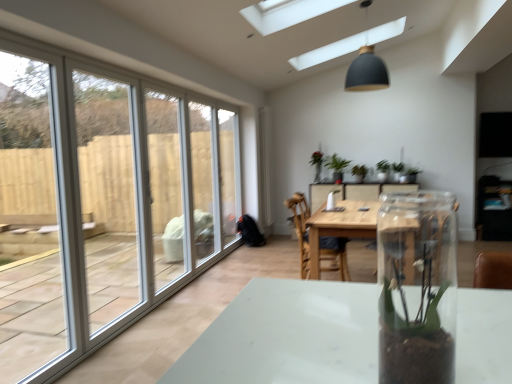
Where is `white plastic screen door at left, placed as the 2th screen door when sorted from back to front`? Image resolution: width=512 pixels, height=384 pixels. white plastic screen door at left, placed as the 2th screen door when sorted from back to front is located at coordinates (106, 196).

Describe the element at coordinates (106, 196) in the screenshot. I see `white plastic screen door at left, placed as the 1th screen door when sorted from front to back` at that location.

The height and width of the screenshot is (384, 512). What do you see at coordinates (301, 229) in the screenshot? I see `wooden chair at center` at bounding box center [301, 229].

The width and height of the screenshot is (512, 384). What do you see at coordinates (417, 287) in the screenshot? I see `clear glass vase at center` at bounding box center [417, 287].

Find the location of a particular element. This screenshot has width=512, height=384. green leafy plant at upper center, the 1th houseplant from the right is located at coordinates (359, 173).

I want to click on white plastic screen door at left, placed as the 2th screen door when sorted from back to front, so click(106, 196).

Can you confirm if green matte plant at center, which appears as the first houseplant when viewed from the left, is positioned to the right of wooden chair at center?

Yes, green matte plant at center, which appears as the first houseplant when viewed from the left, is to the right of wooden chair at center.

Is green matte plant at center, arranged as the second houseplant when viewed from the right, aimed at wooden chair at center?

Yes, green matte plant at center, arranged as the second houseplant when viewed from the right, faces towards wooden chair at center.

Measure the distance between green matte plant at center, which appears as the first houseplant when viewed from the left, and wooden chair at center.

A distance of 1.77 meters exists between green matte plant at center, which appears as the first houseplant when viewed from the left, and wooden chair at center.

From a real-world perspective, who is located higher, green matte plant at center, which appears as the first houseplant when viewed from the left, or wooden chair at center?

green matte plant at center, which appears as the first houseplant when viewed from the left, from a real-world perspective.

Locate an element on the screen. Image resolution: width=512 pixels, height=384 pixels. glass box in front of the white plastic window frame at left is located at coordinates [417, 287].

Are white plastic window frame at left and clear glass vase at center beside each other?

No, white plastic window frame at left is not beside clear glass vase at center.

From the image's perspective, which one is positioned higher, white plastic window frame at left or clear glass vase at center?

white plastic window frame at left appears higher in the image.

From a real-world perspective, between white plastic window frame at left and clear glass vase at center, who is vertically lower?

white plastic window frame at left is physically lower.

Considering the sizes of objects clear glass vase at center and wooden table at center in the image provided, who is thinner, clear glass vase at center or wooden table at center?

clear glass vase at center is thinner.

Is point (429, 293) positioned after point (328, 213)?

No.

From the image's perspective, is clear glass vase at center under wooden table at center?

Incorrect, from the image's perspective, clear glass vase at center is higher than wooden table at center.

In the scene shown: Could you tell me if clear glass screen door at left, which appears as the second screen door when viewed from the front, is turned towards green leafy plant at upper center, acting as the 2th houseplant starting from the left?

No, clear glass screen door at left, which appears as the second screen door when viewed from the front, is not oriented towards green leafy plant at upper center, acting as the 2th houseplant starting from the left.

From the clear glass screen door at left, marked as the first screen door in a back-to-front arrangement, count 2nd houseplant to the right and point to it. Please provide its 2D coordinates.

[(359, 173)]

Can you tell me how much clear glass screen door at left, marked as the first screen door in a back-to-front arrangement, and green leafy plant at upper center, acting as the 2th houseplant starting from the left, differ in facing direction?

The facing directions of clear glass screen door at left, marked as the first screen door in a back-to-front arrangement, and green leafy plant at upper center, acting as the 2th houseplant starting from the left, are 92.2 degrees apart.

Considering the sizes of objects clear glass vase at center and white plastic window frame at left in the image provided, who is thinner, clear glass vase at center or white plastic window frame at left?

clear glass vase at center.

What's the angular difference between clear glass vase at center and white plastic window frame at left's facing directions?

83.9 degrees.

In the image, there is a clear glass vase at center. Identify the location of window frame above it (from the image's perspective). (29, 222).

Is white plastic window frame at left situated inside green leafy plant at upper center, acting as the 2th houseplant starting from the left, or outside?

white plastic window frame at left is outside green leafy plant at upper center, acting as the 2th houseplant starting from the left.

Which object is thinner, white plastic window frame at left or green leafy plant at upper center, acting as the 2th houseplant starting from the left?

white plastic window frame at left is thinner.

From a real-world perspective, is white plastic window frame at left located higher than green leafy plant at upper center, the 1th houseplant from the right?

Yes, from a real-world perspective, white plastic window frame at left is on top of green leafy plant at upper center, the 1th houseplant from the right.

Which object is positioned more to the left, white plastic window frame at left or green leafy plant at upper center, acting as the 2th houseplant starting from the left?

white plastic window frame at left is more to the left.

Between point (103, 93) and point (357, 91), which one is positioned behind?

The point (357, 91) is farther.

Is white plastic screen door at left, placed as the 2th screen door when sorted from back to front, not close to matte black pendant lamp at upper center?

Yes, white plastic screen door at left, placed as the 2th screen door when sorted from back to front, and matte black pendant lamp at upper center are located far from each other.

Is white plastic screen door at left, placed as the 2th screen door when sorted from back to front, positioned in front of matte black pendant lamp at upper center?

Yes, white plastic screen door at left, placed as the 2th screen door when sorted from back to front, is closer to the camera.

Is white plastic screen door at left, placed as the 1th screen door when sorted from front to back, inside or outside of matte black pendant lamp at upper center?

white plastic screen door at left, placed as the 1th screen door when sorted from front to back, is spatially situated outside matte black pendant lamp at upper center.

Identify the location of the 1st houseplant behind when counting from the wooden chair at center. 336,166.

Identify the location of window frame above the clear glass vase at center (from the image's perspective). This screenshot has width=512, height=384. (29, 222).

From the image, which object appears to be nearer to green matte plant at center, which appears as the first houseplant when viewed from the left, clear glass screen door at left, marked as the first screen door in a back-to-front arrangement, or white plastic screen door at left, placed as the 1th screen door when sorted from front to back?

clear glass screen door at left, marked as the first screen door in a back-to-front arrangement.

Looking at this image, from the image, which object appears to be farther from white plastic screen door at left, placed as the 2th screen door when sorted from back to front, matte black pendant lamp at upper center or green leafy plant at upper center, the 1th houseplant from the right?

matte black pendant lamp at upper center.

Which object lies further to the anchor point clear glass vase at center, clear glass screen door at left, marked as the first screen door in a back-to-front arrangement, or green leafy plant at upper center, acting as the 2th houseplant starting from the left?

green leafy plant at upper center, acting as the 2th houseplant starting from the left.

Considering their positions, is clear glass vase at center positioned closer to wooden table at center than matte black pendant lamp at upper center?

matte black pendant lamp at upper center.

From the image, which object appears to be farther from green leafy plant at upper center, acting as the 2th houseplant starting from the left, wooden table at center or white plastic window frame at left?

Based on the image, white plastic window frame at left appears to be further to green leafy plant at upper center, acting as the 2th houseplant starting from the left.

Which object lies further to the anchor point clear glass screen door at left, marked as the first screen door in a back-to-front arrangement, green matte plant at center, which appears as the first houseplant when viewed from the left, or clear glass vase at center?

clear glass vase at center is further to clear glass screen door at left, marked as the first screen door in a back-to-front arrangement.

Considering their positions, is green matte plant at center, which appears as the first houseplant when viewed from the left, positioned closer to green leafy plant at upper center, acting as the 2th houseplant starting from the left, than clear glass vase at center?

green matte plant at center, which appears as the first houseplant when viewed from the left.

Which object lies further to the anchor point green matte plant at center, which appears as the first houseplant when viewed from the left, green leafy plant at upper center, the 1th houseplant from the right, or white plastic screen door at left, placed as the 2th screen door when sorted from back to front?

white plastic screen door at left, placed as the 2th screen door when sorted from back to front.

Find the location of a particular element. Image resolution: width=512 pixels, height=384 pixels. table between clear glass vase at center and green leafy plant at upper center, acting as the 2th houseplant starting from the left, along the z-axis is located at coordinates (340, 227).

Locate an element on the screen. Image resolution: width=512 pixels, height=384 pixels. chair between white plastic window frame at left and green matte plant at center, which appears as the first houseplant when viewed from the left, from front to back is located at coordinates (301, 229).

What are the coordinates of `screen door between clear glass vase at center and wooden table at center along the z-axis` in the screenshot? It's located at (106, 196).

What are the coordinates of `houseplant between matte black pendant lamp at upper center and green leafy plant at upper center, the 1th houseplant from the right, in the front-back direction` in the screenshot? It's located at (336, 166).